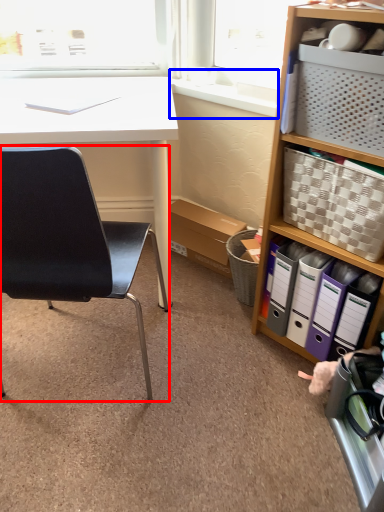
Question: Which object appears closest to the camera in this image, chair (highlighted by a red box) or window sill (highlighted by a blue box)?

Choices:
 (A) chair
 (B) window sill

Answer: (A)